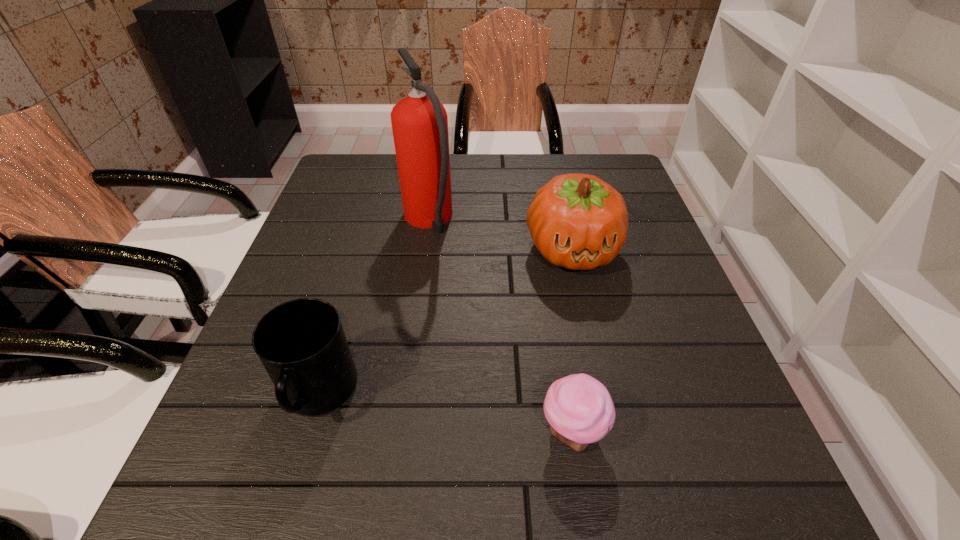
I want to click on vacant space in between the third shortest object and the tallest object, so click(x=500, y=235).

Find the location of a particular element. This screenshot has height=540, width=960. vacant area between the third object from right to left and the second tallest object is located at coordinates (500, 235).

The image size is (960, 540). In order to click on empty space that is in between the fire extinguisher and the pumpkin in this screenshot , I will do pos(500,235).

Locate an element on the screen. vacant space that is in between the cupcake and the mug is located at coordinates (445, 414).

The image size is (960, 540). I want to click on free space that is in between the cupcake and the second shortest object, so click(x=445, y=414).

Identify the location of unoccupied position between the second tallest object and the mug. 445,322.

Where is `free point between the third tallest object and the pumpkin`? free point between the third tallest object and the pumpkin is located at coordinates (445, 322).

Locate an element on the screen. The height and width of the screenshot is (540, 960). empty space between the fire extinguisher and the pumpkin is located at coordinates (500, 235).

The width and height of the screenshot is (960, 540). In order to click on free spot between the third shortest object and the shortest object in this screenshot , I will do tap(572, 341).

At what (x,y) coordinates should I click in order to perform the action: click on free area in between the third object from right to left and the second tallest object. Please return your answer as a coordinate pair (x, y). Looking at the image, I should click on pyautogui.click(x=500, y=235).